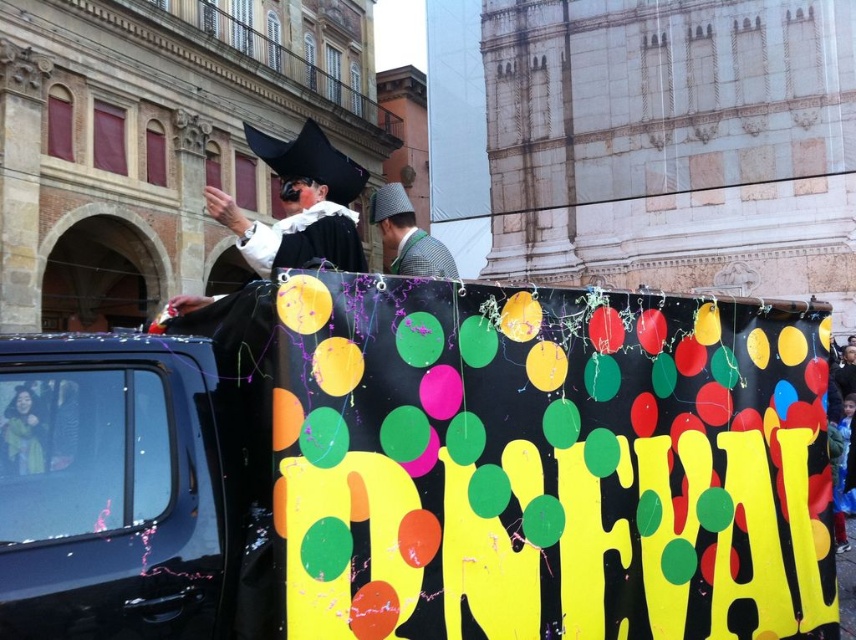
You are a photographer trying to capture the checkered fabric hat at center and the glossy blue car at left in a single frame. Based on their positions, which object would appear closer to the bottom of the photo?

The glossy blue car at left appears closer to the bottom of the photo because it is positioned below the checkered fabric hat at center.

You are a photographer trying to capture the entire scene of the festive parade. You notice the glossy blue car at left is positioned at coordinates 0.764 on the x and 0.130 on the y. To ensure the car is included in your shot, where should you position your camera relative to the car?

The glossy blue car at left is located at coordinates x 0.764 and y 0.130. To include it in the shot, position the camera so that the car remains within the frame, likely by aligning the camera to the right side of the car to capture both the car and the rest of the scene.

Where is the glossy blue car at left located in the image?

The glossy blue car at left is located at the point with coordinates 0.764 in the x axis and 0.130 in the y axis.